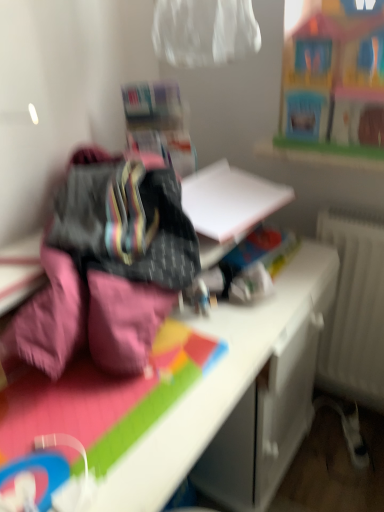
What do you see at coordinates (220, 380) in the screenshot? I see `white glossy desk at center` at bounding box center [220, 380].

What do you see at coordinates (109, 263) in the screenshot? The image size is (384, 512). I see `pink fabric at left` at bounding box center [109, 263].

The height and width of the screenshot is (512, 384). I want to click on white glossy desk at center, so click(x=220, y=380).

From a real-world perspective, relative to pink fabric at left, is wooden toy house at upper right vertically above or below?

wooden toy house at upper right is situated higher than pink fabric at left in the real world.

Between wooden toy house at upper right and pink fabric at left, which one is positioned behind?

wooden toy house at upper right is more distant.

Is wooden toy house at upper right bigger or smaller than pink fabric at left?

Clearly, wooden toy house at upper right is smaller in size than pink fabric at left.

Where is `toy on the right of pink fabric at left`? toy on the right of pink fabric at left is located at coordinates (328, 70).

From the image's perspective, which one is positioned higher, wooden toy house at upper right or white glossy desk at center?

From the image's view, wooden toy house at upper right is above.

Does wooden toy house at upper right have a lesser height compared to white glossy desk at center?

Yes.

Can you confirm if wooden toy house at upper right is thinner than white glossy desk at center?

Yes, wooden toy house at upper right is thinner than white glossy desk at center.

Can you confirm if wooden toy house at upper right is bigger than white glossy desk at center?

No.

In the scene shown: Which is closer, (234, 353) or (310, 81)?

Point (234, 353) is positioned closer to the camera compared to point (310, 81).

Can you confirm if white glossy desk at center is wider than wooden toy house at upper right?

Indeed, white glossy desk at center has a greater width compared to wooden toy house at upper right.

From a real-world perspective, is white glossy desk at center physically above wooden toy house at upper right?

Incorrect, from a real-world perspective, white glossy desk at center is lower than wooden toy house at upper right.

Would you say white glossy desk at center is to the left or to the right of wooden toy house at upper right in the picture?

From the image, it's evident that white glossy desk at center is to the left of wooden toy house at upper right.

Is point (325, 267) in front of point (140, 295)?

That is False.

From a real-world perspective, who is located lower, white glossy desk at center or pink fabric at left?

From a 3D spatial view, white glossy desk at center is below.

From the image's perspective, is white glossy desk at center beneath pink fabric at left?

Yes, from the image's perspective, white glossy desk at center is beneath pink fabric at left.

Is white glossy desk at center facing towards pink fabric at left?

No, white glossy desk at center does not turn towards pink fabric at left.

Locate an element on the screen. bedding below the wooden toy house at upper right (from the image's perspective) is located at coordinates (109, 263).

Can you tell me how much pink fabric at left and wooden toy house at upper right differ in facing direction?

They differ by 87.6 degrees in their facing directions.

How much distance is there between pink fabric at left and wooden toy house at upper right?

51.45 centimeters.

Consider the image. Is pink fabric at left positioned with its back to wooden toy house at upper right?

That's not correct — pink fabric at left is not looking away from wooden toy house at upper right.

From a real-world perspective, does pink fabric at left sit lower than white glossy desk at center?

No, from a real-world perspective, pink fabric at left is not below white glossy desk at center.

Considering the positions of point (128, 334) and point (258, 310), is point (128, 334) closer or farther from the camera than point (258, 310)?

Point (128, 334) appears to be closer to the viewer than point (258, 310).

Is pink fabric at left oriented towards white glossy desk at center?

No, pink fabric at left is not oriented towards white glossy desk at center.

You are a GUI agent. You are given a task and a screenshot of the screen. Output one action in this format:
    pyautogui.click(x=<x>, y=<y>)
    Task: Click on the toy that appears on the right of pink fabric at left
    Image resolution: width=384 pixels, height=512 pixels.
    Given the screenshot: What is the action you would take?
    pyautogui.click(x=328, y=70)

The image size is (384, 512). What are the coordinates of `toy behind the white glossy desk at center` in the screenshot? It's located at (328, 70).

When comparing their distances from wooden toy house at upper right, does white glossy desk at center or pink fabric at left seem closer?

white glossy desk at center lies closer to wooden toy house at upper right than the other object.

Considering their positions, is pink fabric at left positioned further to wooden toy house at upper right than white glossy desk at center?

pink fabric at left is positioned further to the anchor wooden toy house at upper right.

When comparing their distances from white glossy desk at center, does pink fabric at left or wooden toy house at upper right seem further?

The object further to white glossy desk at center is wooden toy house at upper right.

Considering their positions, is white glossy desk at center positioned further to pink fabric at left than wooden toy house at upper right?

The object further to pink fabric at left is wooden toy house at upper right.

Estimate the real-world distances between objects in this image. Which object is closer to white glossy desk at center, wooden toy house at upper right or pink fabric at left?

pink fabric at left lies closer to white glossy desk at center than the other object.

Which object lies further to the anchor point pink fabric at left, wooden toy house at upper right or white glossy desk at center?

Based on the image, wooden toy house at upper right appears to be further to pink fabric at left.

You are a GUI agent. You are given a task and a screenshot of the screen. Output one action in this format:
    pyautogui.click(x=<x>, y=<y>)
    Task: Click on the bedding that lies between wooden toy house at upper right and white glossy desk at center from top to bottom
    The width and height of the screenshot is (384, 512).
    Given the screenshot: What is the action you would take?
    pyautogui.click(x=109, y=263)